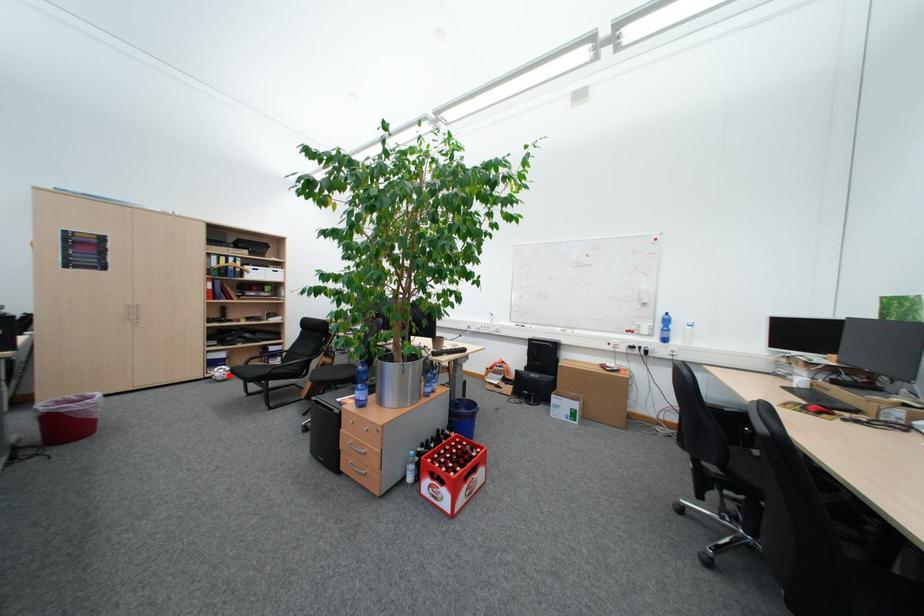
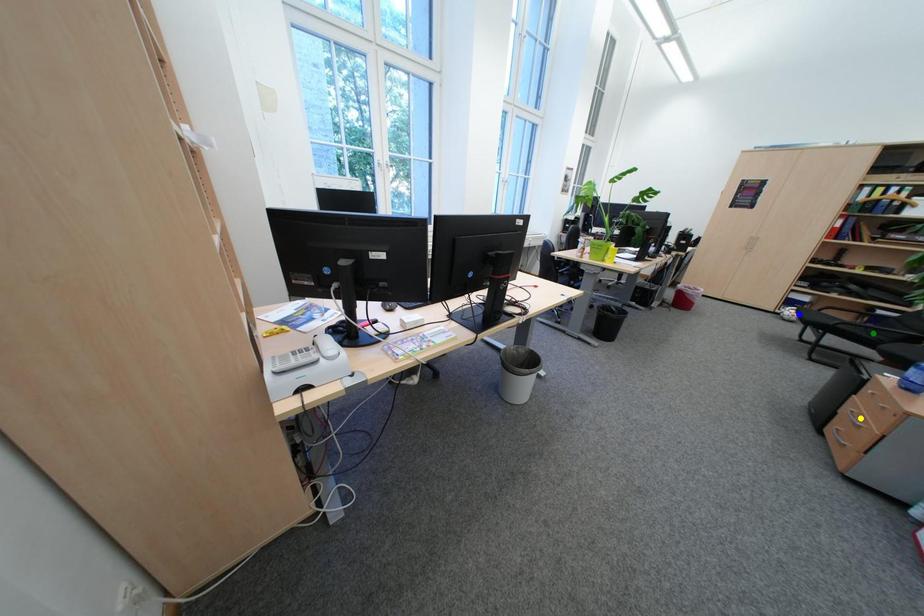
Question: I am providing you with two images of the same scene from different viewpoints. A red point is marked on the first image. You are given multiple points on the second image. Which spot in image 2 lines up with the point in image 1?

Choices:
 (A) yellow point
 (B) blue point
 (C) green point

Answer: (B)